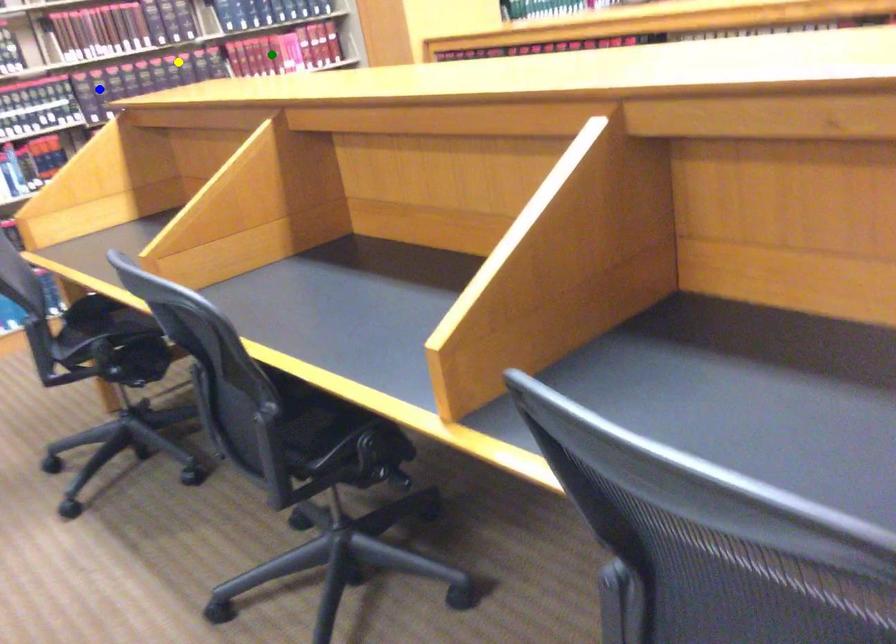
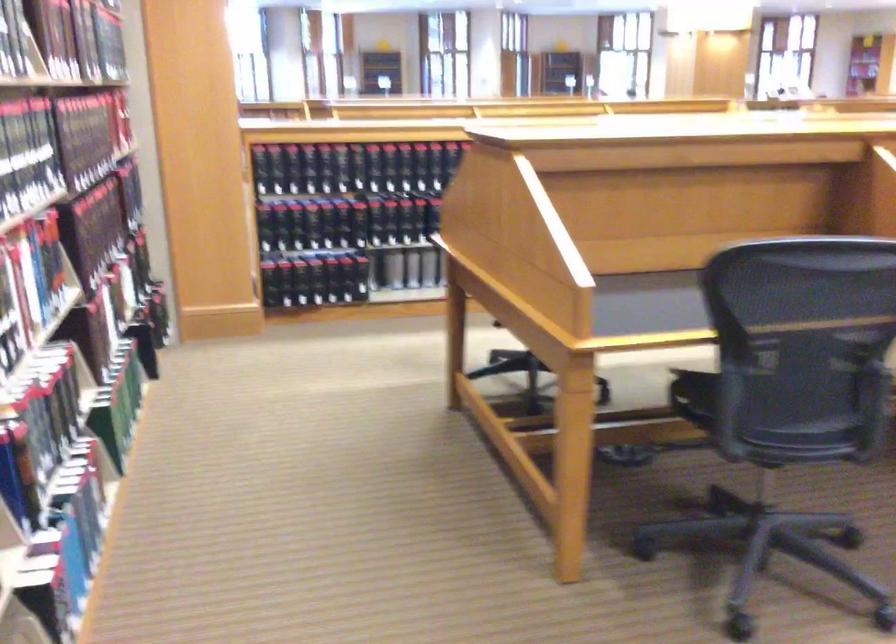
I am providing you with two images of the same scene from different viewpoints. Three points are marked in image1. Which point corresponds to a part or object that is occluded in image2?In image1, three points are marked. Which of them correspond to a part or object that is occluded in image2?Among the three points shown in image1, which one corresponds to a part or object that is no longer visible due to occlusion in image2?

Invisible in image2: yellow point, green point, blue point.